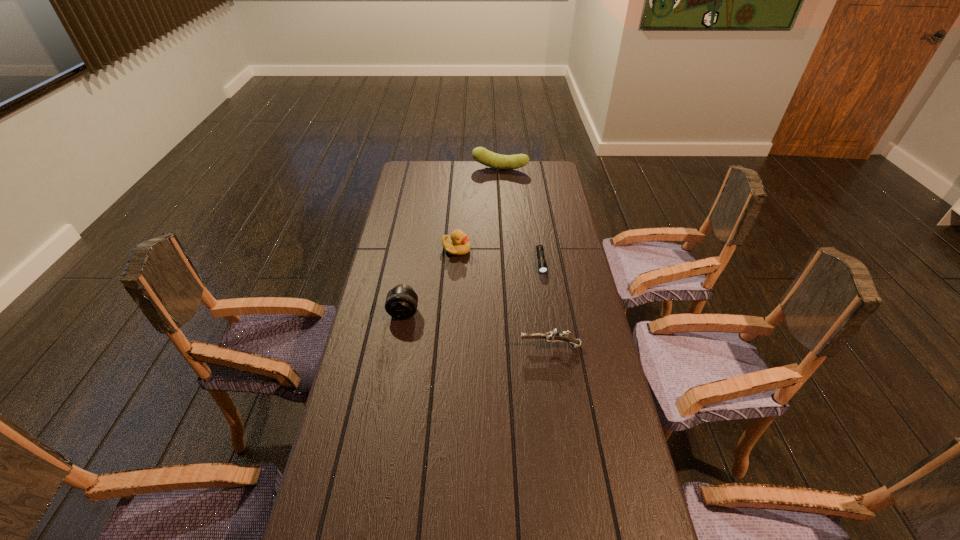
You are a GUI agent. You are given a task and a screenshot of the screen. Output one action in this format:
    pyautogui.click(x=<x>, y=<y>)
    Task: Click on the empty space that is in between the nearest object and the flashlight
    The image size is (960, 540).
    Given the screenshot: What is the action you would take?
    pyautogui.click(x=545, y=304)

The height and width of the screenshot is (540, 960). I want to click on free area in between the nearest object and the flashlight, so click(545, 304).

The height and width of the screenshot is (540, 960). I want to click on object that is the second nearest to the cucumber, so click(x=542, y=265).

You are a GUI agent. You are given a task and a screenshot of the screen. Output one action in this format:
    pyautogui.click(x=<x>, y=<y>)
    Task: Click on the second closest object to the gun
    
    Given the screenshot: What is the action you would take?
    pyautogui.click(x=401, y=302)

Image resolution: width=960 pixels, height=540 pixels. I want to click on free location that satisfies the following two spatial constraints: 1. at the lens end of the flashlight; 2. aimed along the barrel of the gun, so click(554, 347).

Locate an element on the screen. This screenshot has width=960, height=540. vacant region that satisfies the following two spatial constraints: 1. on the beak of the duckling; 2. on the front-facing side of the second nearest object is located at coordinates (452, 312).

Where is `free location that satisfies the following two spatial constraints: 1. at the lens end of the flashlight; 2. aimed along the barrel of the fourth tallest object`? The image size is (960, 540). free location that satisfies the following two spatial constraints: 1. at the lens end of the flashlight; 2. aimed along the barrel of the fourth tallest object is located at coordinates (554, 347).

You are a GUI agent. You are given a task and a screenshot of the screen. Output one action in this format:
    pyautogui.click(x=<x>, y=<y>)
    Task: Click on the free space in the image that satisfies the following two spatial constraints: 1. at the lens end of the shortest object; 2. aimed along the barrel of the nearest object
    The image size is (960, 540).
    Given the screenshot: What is the action you would take?
    pyautogui.click(x=554, y=347)